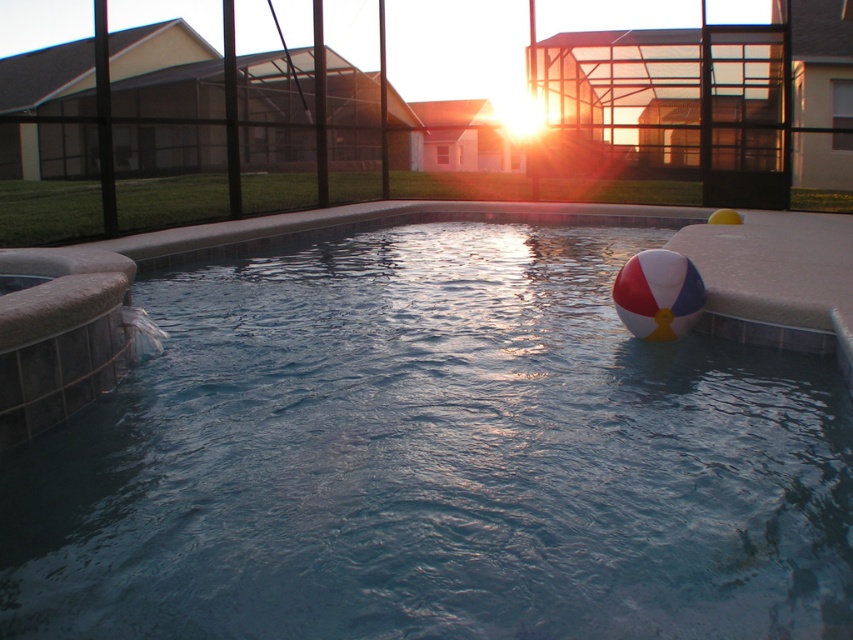
You are a maintenance worker who needs to place a 1.5 meter long ladder between the blue rubber ball at upper right and the white and red striped beach ball at right. Can you fit the ladder horizontally between them without moving the balls?

The distance between the blue rubber ball at upper right and the white and red striped beach ball at right is 1.27 meters. Since the ladder is 1.5 meters long, it cannot fit horizontally between them as the space is shorter than the ladder.

You are planning to place both the blue rubber ball at upper right and the white and red striped beach ball at right on a shelf that can only hold items up to the size of the larger one. Which ball should you choose to fit on the shelf?

The blue rubber ball at upper right is larger in size than the white and red striped beach ball at right, so you should choose the blue rubber ball at upper right to fit on the shelf since the shelf can hold items up to its size.